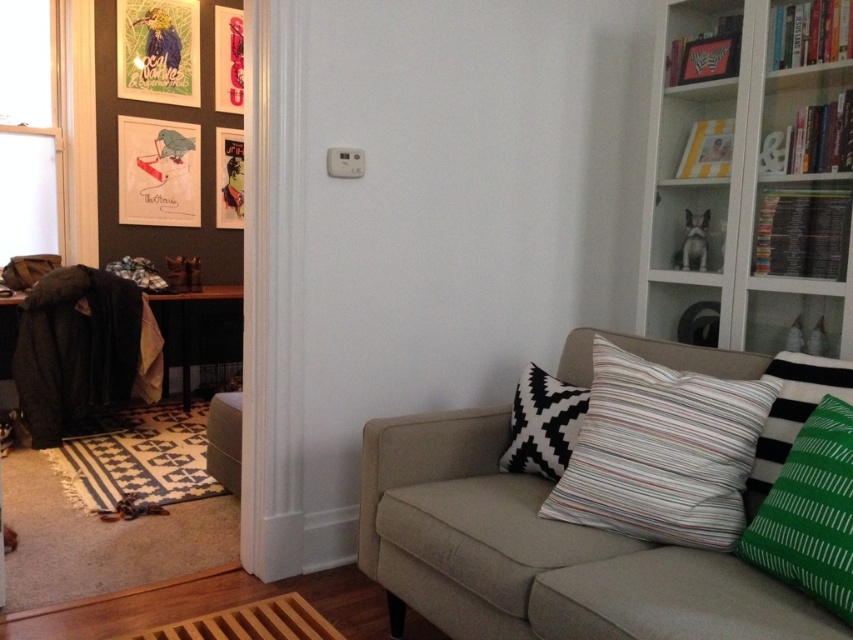
You are standing in the living room and want to place a tall plant next to the beige fabric couch at center. Considering the white glass bookshelf at upper right is above it, will the plant obstruct the view of the bookshelf?

The beige fabric couch at center is located below the white glass bookshelf at upper right, so placing the plant next to the couch would not obstruct the view of the bookshelf since it is positioned above.

You are moving a 36 inch wide painting to hang between the white glass bookshelf at upper right and the green striped pillow at right. Will the painting fit in the space between them?

The white glass bookshelf at upper right and green striped pillow at right are 36.41 inches apart, so the 36 inch wide painting will fit with a small gap remaining between them.